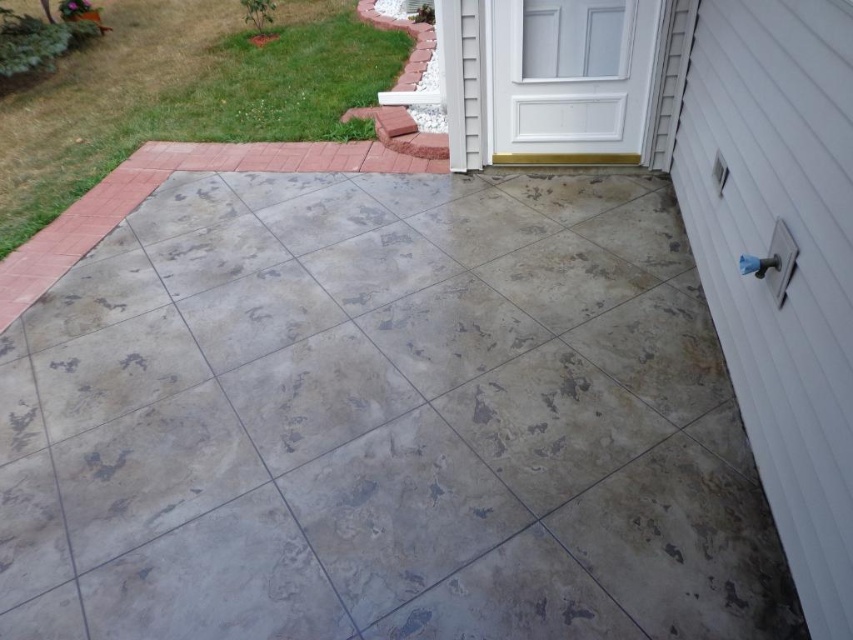
You are standing at point (x=381, y=422) in the residential outdoor area. What material are you standing on?

You are standing on gray concrete at center.

You are standing on the grassy lawn near the red brick pathway and want to reach the gray concrete at center. According to the coordinates provided, in which direction should you move relative to your current position?

The gray concrete at center is located at point coordinates, so you should move towards the center area from your current position on the grassy lawn near the red brick pathway.